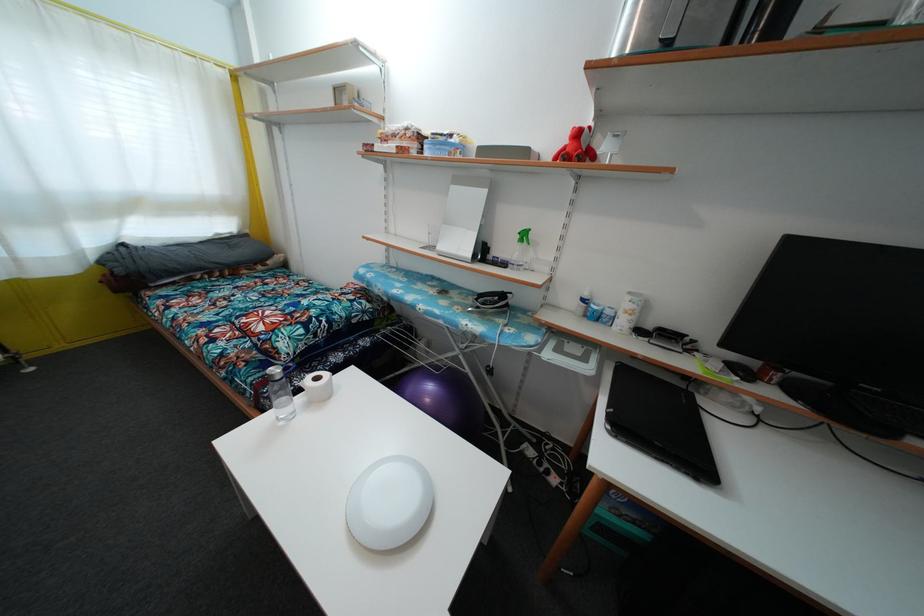
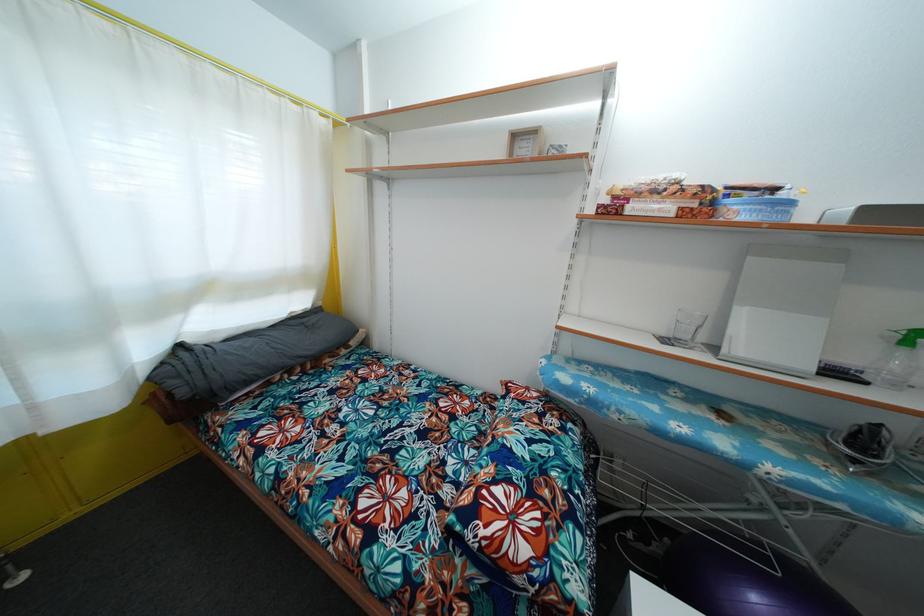
Question: I am providing you with two images of the same scene from different viewpoints. Please identify which objects are invisible in image2.

Choices:
 (A) purple exercise ball
 (B) small framed picture
 (C) grey pillow
 (D) none of these

Answer: (D)